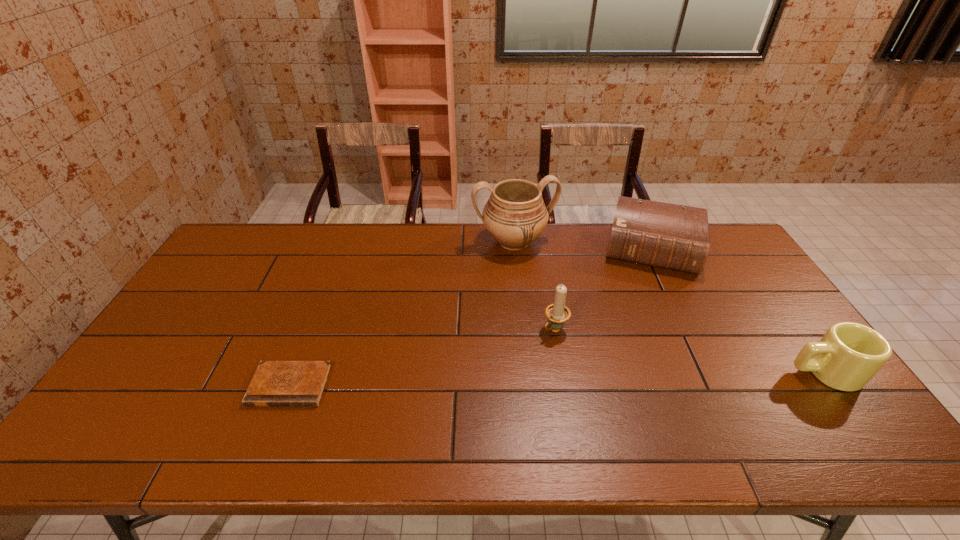
The height and width of the screenshot is (540, 960). Find the location of `diary`. diary is located at coordinates (275, 383).

Locate an element on the screen. The image size is (960, 540). the leftmost object is located at coordinates (275, 383).

Where is `mug`? mug is located at coordinates (849, 354).

The width and height of the screenshot is (960, 540). I want to click on urn, so click(x=515, y=215).

This screenshot has width=960, height=540. In order to click on the third nearest object in this screenshot , I will do `click(557, 314)`.

Where is `the second tallest object`? The width and height of the screenshot is (960, 540). the second tallest object is located at coordinates (557, 314).

Identify the location of the second object from right to left. Image resolution: width=960 pixels, height=540 pixels. (670, 236).

Locate an element on the screen. This screenshot has width=960, height=540. free space located 0.090m with the handle on the side of the mug is located at coordinates (756, 372).

I want to click on free spot located 0.390m with the handle on the side of the mug, so click(x=640, y=372).

You are a GUI agent. You are given a task and a screenshot of the screen. Output one action in this format:
    pyautogui.click(x=<x>, y=<y>)
    Task: Click on the vacant area situated with the handle on the side of the mug
    The height and width of the screenshot is (540, 960).
    Given the screenshot: What is the action you would take?
    pyautogui.click(x=675, y=372)